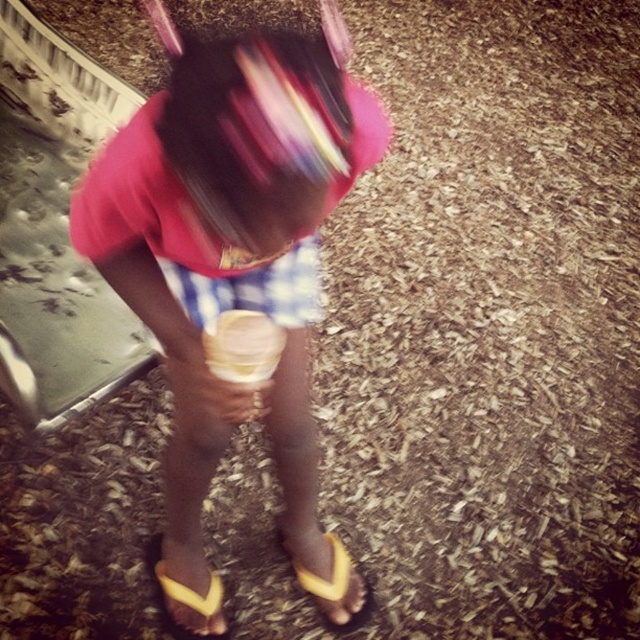
Is yellow flip-flops at lower center to the right of yellow rubber sandal at lower center from the viewer's perspective?

Correct, you'll find yellow flip-flops at lower center to the right of yellow rubber sandal at lower center.

Does yellow flip-flops at lower center appear over yellow rubber sandal at lower center?

Indeed, yellow flip-flops at lower center is positioned over yellow rubber sandal at lower center.

Who is more forward, [214,122] or [202,604]?

Point [214,122] is more forward.

The width and height of the screenshot is (640, 640). In order to click on yellow flip-flops at lower center in this screenshot , I will do `click(228, 248)`.

Is yellow flip-flops at lower center bigger than yellow flip-flop at lower center?

Yes, yellow flip-flops at lower center is bigger than yellow flip-flop at lower center.

Does point (269, 298) come farther from viewer compared to point (317, 579)?

No, it is in front of (317, 579).

This screenshot has width=640, height=640. Identify the location of yellow flip-flops at lower center. (228, 248).

Can you confirm if yellow flip-flop at lower center is positioned above yellow rubber sandal at lower center?

Indeed, yellow flip-flop at lower center is positioned over yellow rubber sandal at lower center.

Is yellow flip-flop at lower center further to the viewer compared to yellow rubber sandal at lower center?

Yes, it is.

Image resolution: width=640 pixels, height=640 pixels. What do you see at coordinates (332, 580) in the screenshot?
I see `yellow flip-flop at lower center` at bounding box center [332, 580].

This screenshot has width=640, height=640. What are the coordinates of `yellow flip-flop at lower center` in the screenshot? It's located at (332, 580).